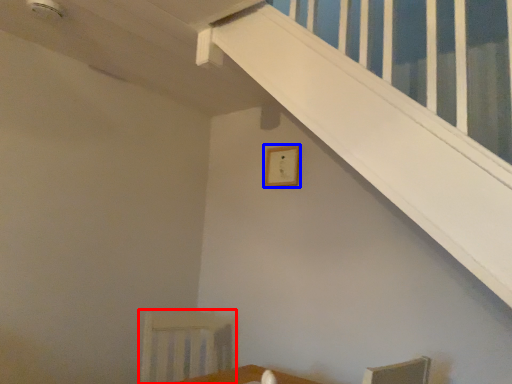
Question: Among these objects, which one is nearest to the camera, armchair (highlighted by a red box) or picture frame (highlighted by a blue box)?

Choices:
 (A) armchair
 (B) picture frame

Answer: (A)